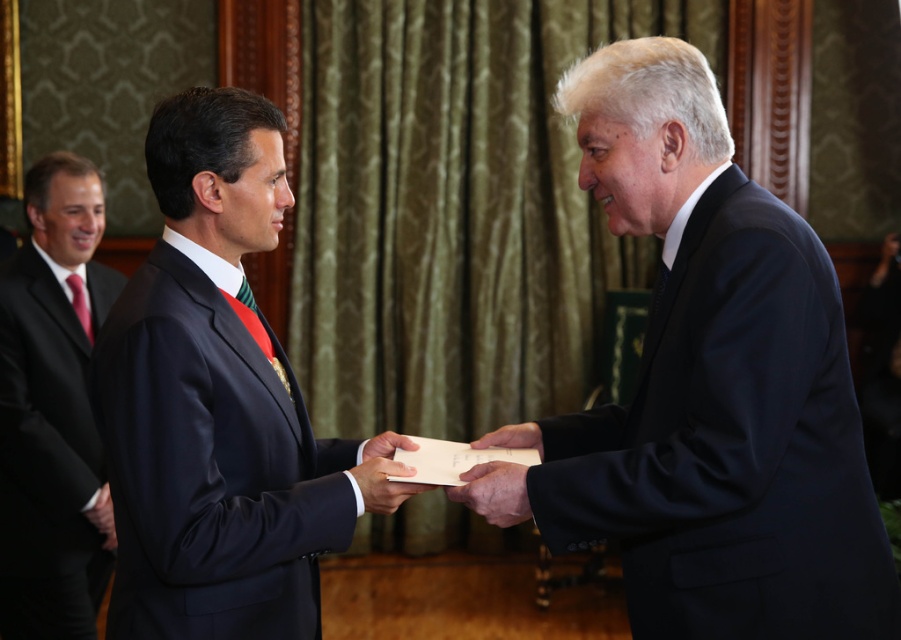
You are an event planner organizing a formal ceremony. You need to place both the white paper at center and the matte black folder at center on a table. Given that the table has limited space, which object should you place first to ensure both fit properly?

The white paper at center has a larger width than the matte black folder at center, so you should place the matte black folder at center first to accommodate the larger white paper at center.

You are an event photographer at a formal ceremony. You need to capture a photo of the black matte suit at center and the red silk tie at left. Since you can only focus on one subject, which one should you focus on to ensure the other is still visible in the background?

You should focus on the black matte suit at center because it is in front of the red silk tie at left, so the red silk tie at left will be visible in the background.

You are an event photographer at a formal ceremony. You need to capture a clear photo of the matte black suit at center and the white paper at center. Based on their positions, which object is closer to the camera?

The matte black suit at center is closer to the camera because it is in front of the white paper at center.